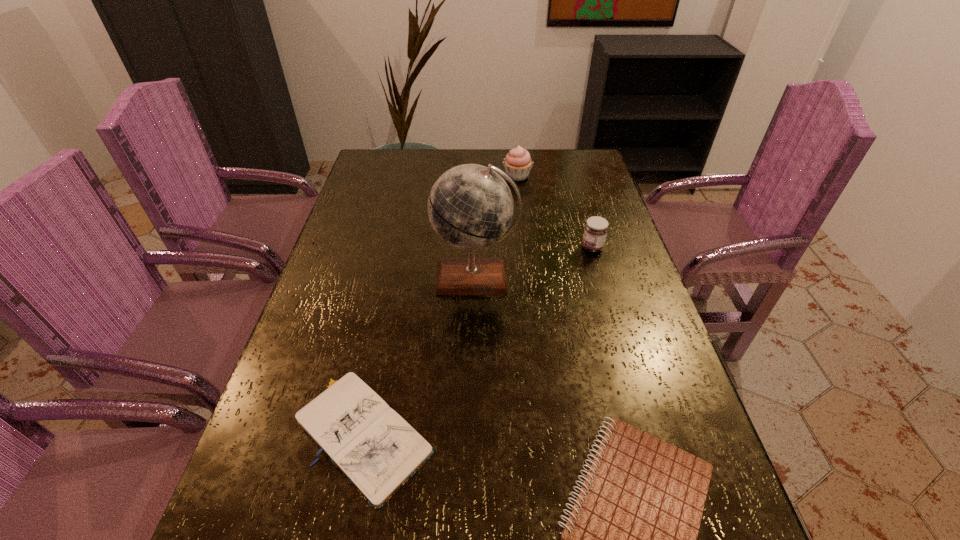
The height and width of the screenshot is (540, 960). Identify the location of the tallest object. (470, 207).

The height and width of the screenshot is (540, 960). What are the coordinates of `the farthest object` in the screenshot? It's located at (517, 163).

The height and width of the screenshot is (540, 960). In order to click on the fourth shortest object in this screenshot , I will do `click(517, 163)`.

At what (x,y) coordinates should I click in order to perform the action: click on jam. Please return your answer as a coordinate pair (x, y). Looking at the image, I should click on click(x=596, y=228).

I want to click on the left notebook, so click(x=377, y=451).

Where is `free space located 0.070m at the equator of the globe`? This screenshot has width=960, height=540. free space located 0.070m at the equator of the globe is located at coordinates (474, 327).

Identify the location of free region located on the front of the fourth shortest object. The height and width of the screenshot is (540, 960). (523, 226).

The width and height of the screenshot is (960, 540). What are the coordinates of `vacant space located 0.120m on the front label of the jam` in the screenshot? It's located at (539, 248).

Where is `free space located 0.340m on the front label of the jam`? free space located 0.340m on the front label of the jam is located at coordinates (459, 248).

Where is `vacant space situated 0.080m on the front label of the jam`? The height and width of the screenshot is (540, 960). vacant space situated 0.080m on the front label of the jam is located at coordinates (553, 248).